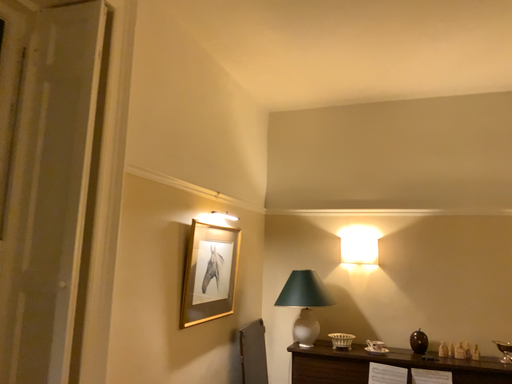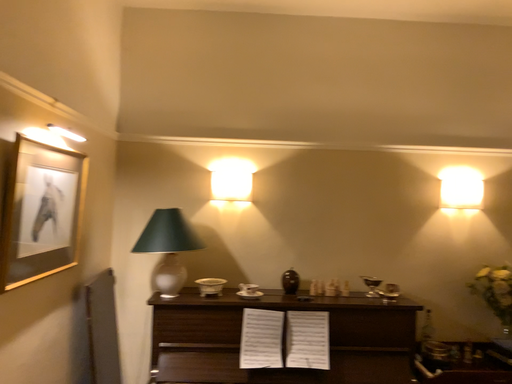
Question: How did the camera likely rotate when shooting the video?

Choices:
 (A) rotated upward
 (B) rotated downward

Answer: (B)